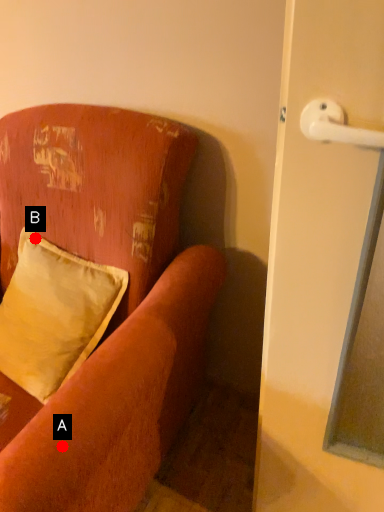
Question: Two points are circled on the image, labeled by A and B beside each circle. Which point is closer to the camera taking this photo?

Choices:
 (A) A is closer
 (B) B is closer

Answer: (A)